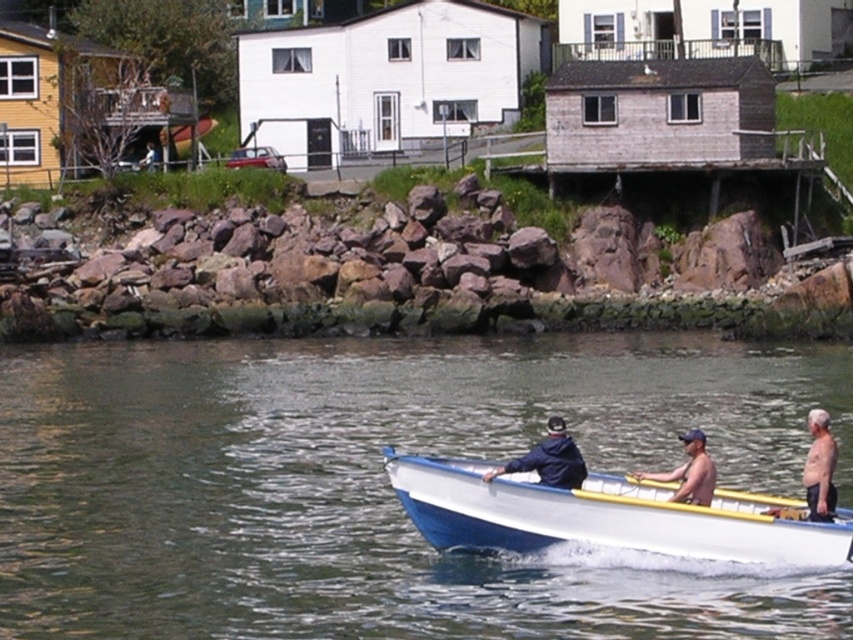
Question: Among these objects, which one is nearest to the camera?

Choices:
 (A) clear water at center
 (B) tan skin man at lower center
 (C) dark blue jacket at center

Answer: (A)

Question: Where is white glossy boat at center located in relation to light blue wood boat at center in the image?

Choices:
 (A) above
 (B) below

Answer: (B)

Question: Which object is positioned closest to the dark blue jacket at center?

Choices:
 (A) tan skin man at lower center
 (B) clear water at center

Answer: (A)

Question: Is white glossy boat at center positioned at the back of skinny tan man at right?

Choices:
 (A) yes
 (B) no

Answer: (B)

Question: Is dark blue jacket at center behind tan skin man at lower center?

Choices:
 (A) no
 (B) yes

Answer: (B)

Question: Among these points, which one is nearest to the camera?

Choices:
 (A) (834, 502)
 (B) (822, 468)

Answer: (B)